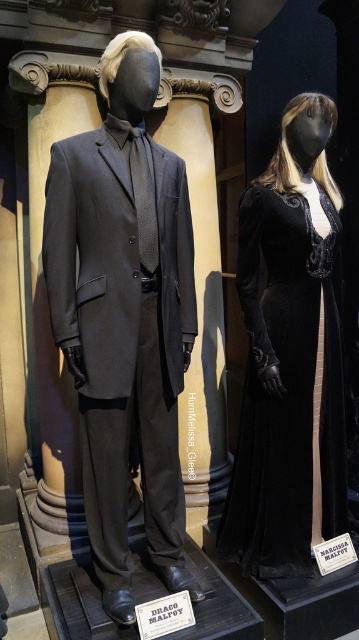
How distant is matte black suit at center from velvet black dress at right?

matte black suit at center is 16.75 inches from velvet black dress at right.

Does matte black suit at center have a lesser height compared to velvet black dress at right?

In fact, matte black suit at center may be taller than velvet black dress at right.

At what (x,y) coordinates should I click in order to perform the action: click on matte black suit at center. Please return your answer as a coordinate pair (x, y). The height and width of the screenshot is (640, 359). Looking at the image, I should click on (124, 316).